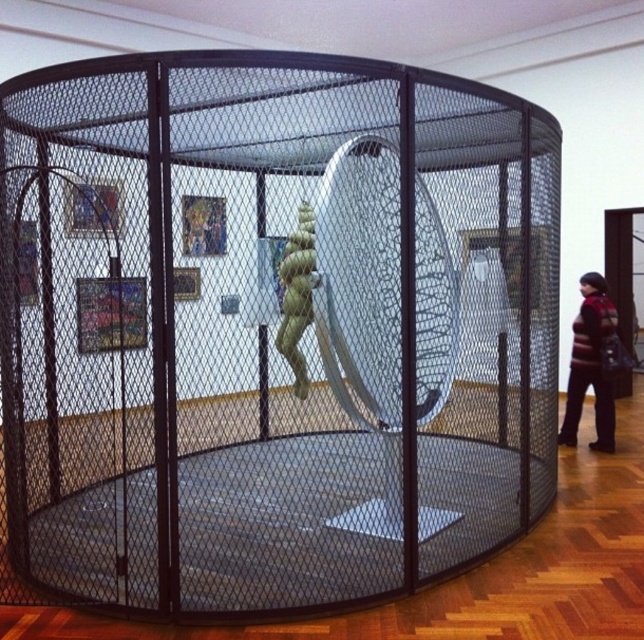
From the picture: You are an art curator who wants to place a new sculpture on the left side of the striped sweater at right. Which direction should you move the green matte sculpture at center to make space?

To place the new sculpture on the left side of the striped sweater at right, you should move the green matte sculpture at center to the left, as the striped sweater at right is currently positioned to the right of it.

You are an art curator deciding where to place a new sculpture. You have a striped sweater at right and a green matte sculpture at center in the current layout. Which object is taller, and how does this affect placement decisions?

The striped sweater at right is taller than the green matte sculpture at center. This means when placing new sculptures, you should consider the height differences to maintain visual balance and ensure the taller object doesn not overpower the shorter one.

From the picture: You are an art curator standing in the gallery and you need to place a new sculpture on a shelf that is at the same height as the green matte sculpture at center. Where should you place the new sculpture so it doesn not block the view of the striped sweater at right?

The striped sweater at right is located below the green matte sculpture at center, so placing the new sculpture at the same height as the green matte sculpture at center would not block the view of the striped sweater at right since it is positioned lower.